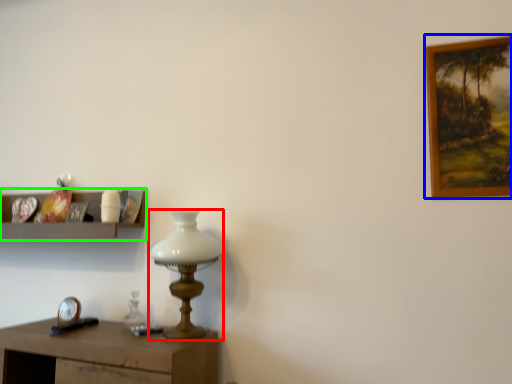
Question: Which object is positioned closest to table lamp (highlighted by a red box)? Select from picture frame (highlighted by a blue box) and shelf (highlighted by a green box).

Choices:
 (A) picture frame
 (B) shelf

Answer: (B)